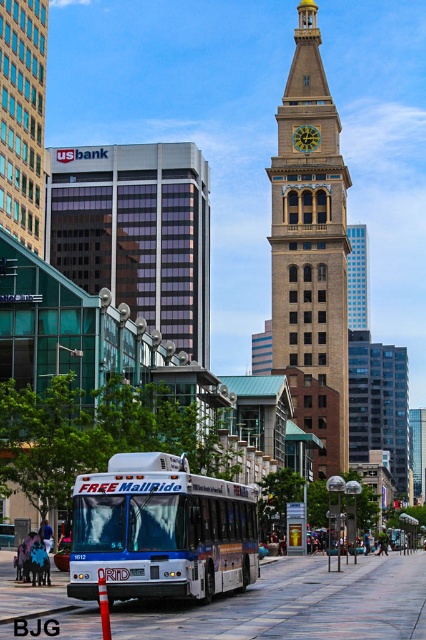
Does brown stone clock tower at center lie behind blue matte bus at center?

Yes, it is behind blue matte bus at center.

Is point (293, 308) closer to viewer compared to point (124, 522)?

No, (293, 308) is further to viewer.

Image resolution: width=426 pixels, height=640 pixels. I want to click on brown stone clock tower at center, so pos(310,248).